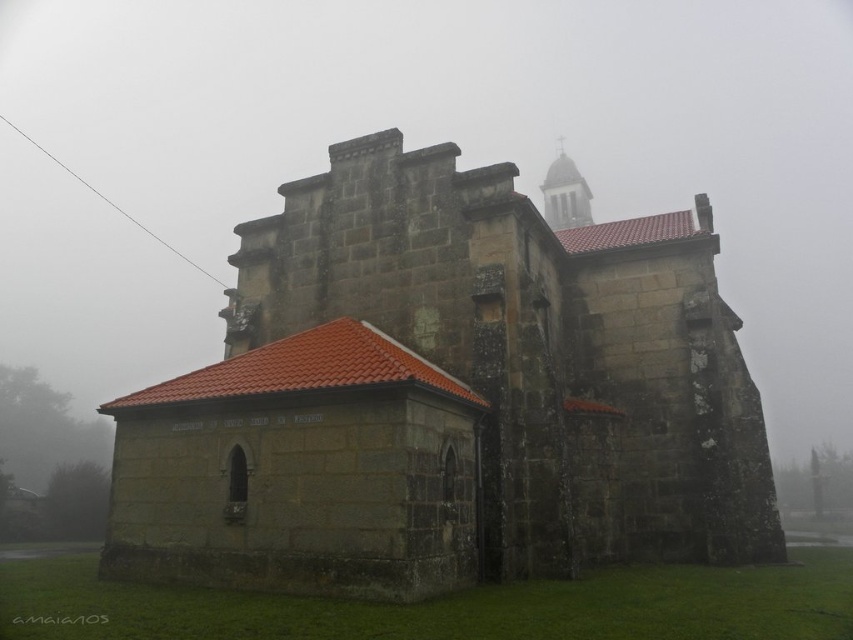
Which is behind, point (566, 568) or point (572, 221)?

Point (572, 221)

Who is taller, dark stone church at center or smooth stone tower at upper center?

Standing taller between the two is smooth stone tower at upper center.

Find the location of a particular element. dark stone church at center is located at coordinates (445, 397).